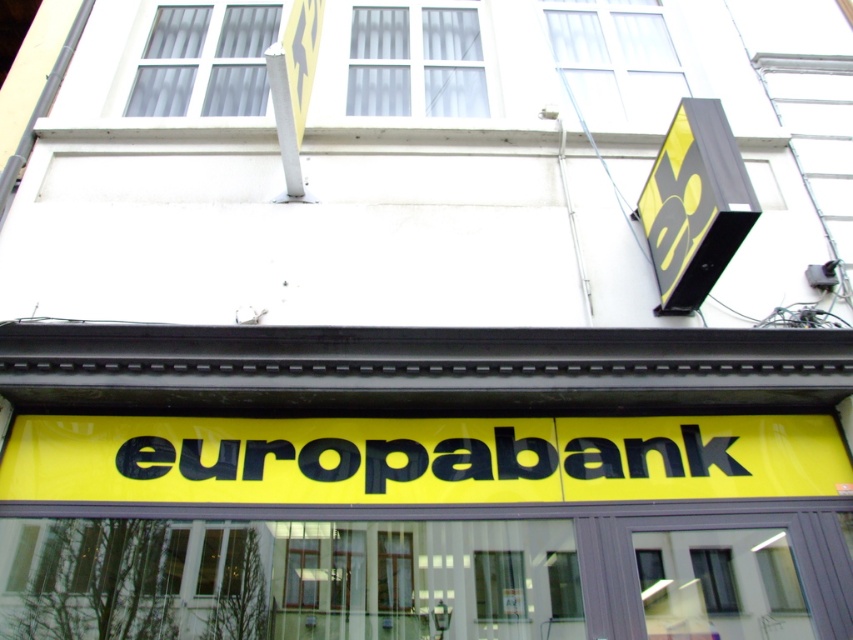
Question: Does transparent glass window at upper center lie behind transparent glass window at center?

Choices:
 (A) yes
 (B) no

Answer: (A)

Question: Which object is closer to the camera taking this photo?

Choices:
 (A) yellow matte/black sign at center
 (B) transparent glass window at upper center
 (C) yellow matte signboard at center

Answer: (C)

Question: Is yellow matte signboard at center further to the viewer compared to yellow matte/black sign at center?

Choices:
 (A) no
 (B) yes

Answer: (A)

Question: Which object appears closest to the camera in this image?

Choices:
 (A) clear glass window at upper center
 (B) transparent glass window at upper center

Answer: (A)

Question: Does clear glass window at upper center have a lesser width compared to transparent glass window at center?

Choices:
 (A) no
 (B) yes

Answer: (A)

Question: Which of the following is the closest to the observer?

Choices:
 (A) white glass window at upper center
 (B) transparent glass window at upper center
 (C) yellow matte signboard at center

Answer: (C)